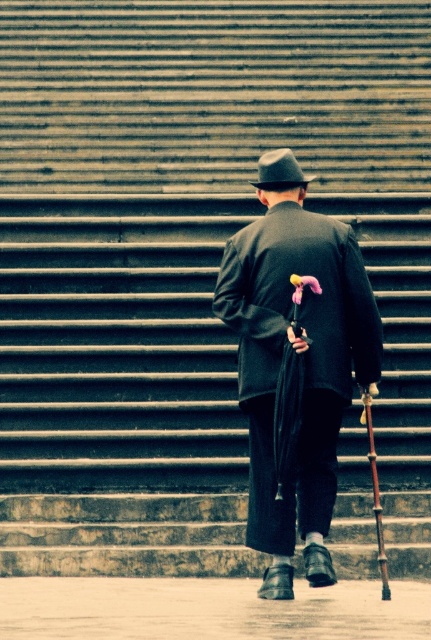
Question: Is matte black coat at center further to camera compared to matte black fedora at center?

Choices:
 (A) yes
 (B) no

Answer: (B)

Question: Can you confirm if matte black coat at center is bigger than matte black fedora at center?

Choices:
 (A) no
 (B) yes

Answer: (B)

Question: Can you confirm if matte black coat at center is bigger than matte black fedora at center?

Choices:
 (A) yes
 (B) no

Answer: (A)

Question: Among these objects, which one is nearest to the camera?

Choices:
 (A) matte black coat at center
 (B) matte black fedora at center

Answer: (A)